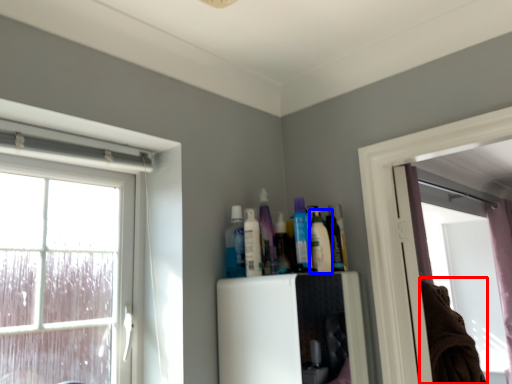
Question: Which object appears closest to the camera in this image, laundry (highlighted by a red box) or toiletry (highlighted by a blue box)?

Choices:
 (A) laundry
 (B) toiletry

Answer: (B)